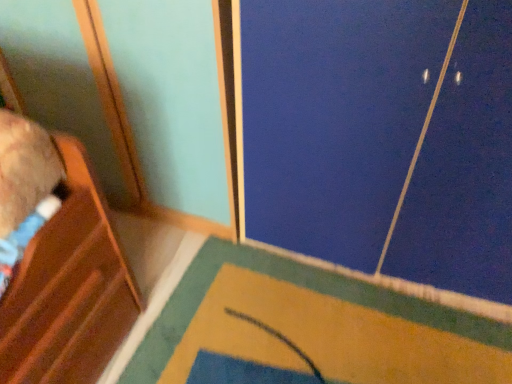
The image size is (512, 384). What do you see at coordinates (309, 330) in the screenshot?
I see `yellow fabric doormat at lower center` at bounding box center [309, 330].

Where is `yellow fabric doormat at lower center`? yellow fabric doormat at lower center is located at coordinates 309,330.

What is the approximate height of yellow fabric doormat at lower center?

It is 1.87 inches.

Where is `yellow fabric doormat at lower center`? yellow fabric doormat at lower center is located at coordinates (309, 330).